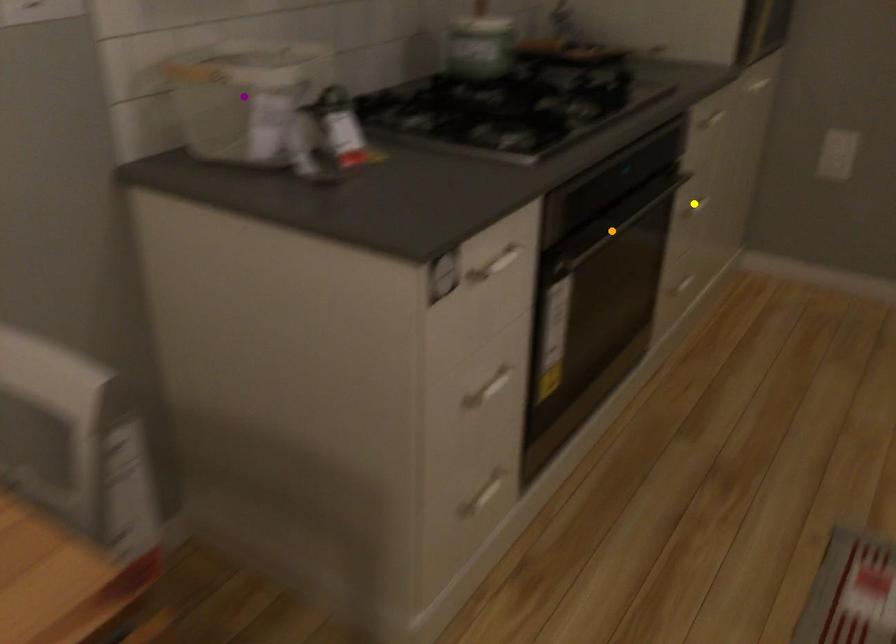
Order these from nearest to farthest:
- yellow point
- orange point
- purple point

yellow point, orange point, purple point